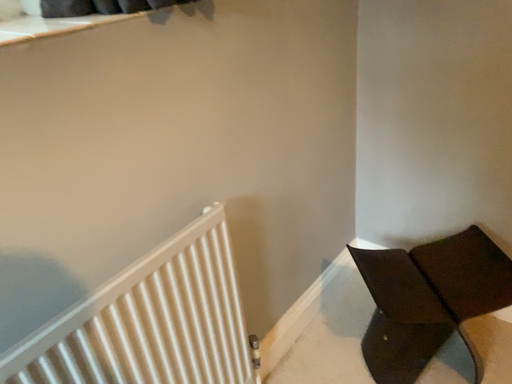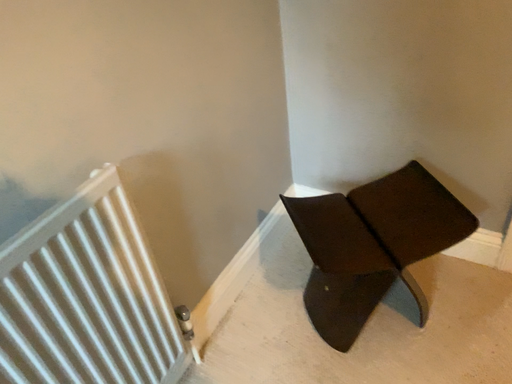
Question: Which way did the camera rotate in the video?

Choices:
 (A) rotated right
 (B) rotated left

Answer: (A)